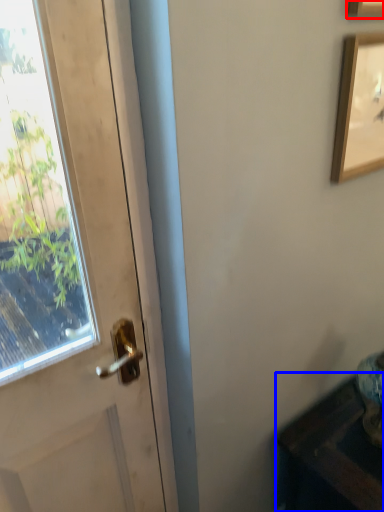
Question: Among these objects, which one is farthest to the camera, picture frame (highlighted by a red box) or furniture (highlighted by a blue box)?

Choices:
 (A) picture frame
 (B) furniture

Answer: (B)